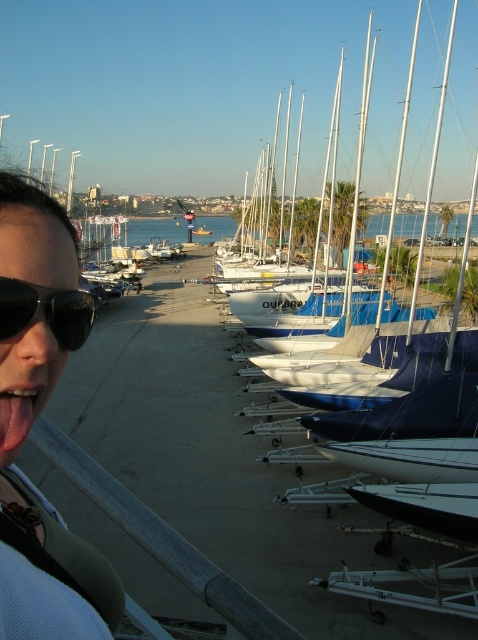
Question: Is sunglasses at left smaller than white matte sailboat at center?

Choices:
 (A) yes
 (B) no

Answer: (A)

Question: Considering the relative positions of black reflective sunglasses at lower left and pink glossy tongue at lower left in the image provided, where is black reflective sunglasses at lower left located with respect to pink glossy tongue at lower left?

Choices:
 (A) right
 (B) left

Answer: (B)

Question: Which of these objects is positioned farthest from the white matte boat at center?

Choices:
 (A) pink glossy tongue at lower left
 (B) black reflective sunglasses at lower left
 (C) sunglasses at left
 (D) white matte sailboat at center

Answer: (D)

Question: Can you confirm if white matte boat at center is thinner than white matte sailboat at center?

Choices:
 (A) no
 (B) yes

Answer: (B)

Question: Among these objects, which one is nearest to the camera?

Choices:
 (A) sunglasses at left
 (B) black reflective sunglasses at lower left
 (C) white matte boat at center

Answer: (A)

Question: Which point is closer to the camera?

Choices:
 (A) (395, 512)
 (B) (10, 332)
 (C) (196, 227)
 (D) (31, 252)

Answer: (B)